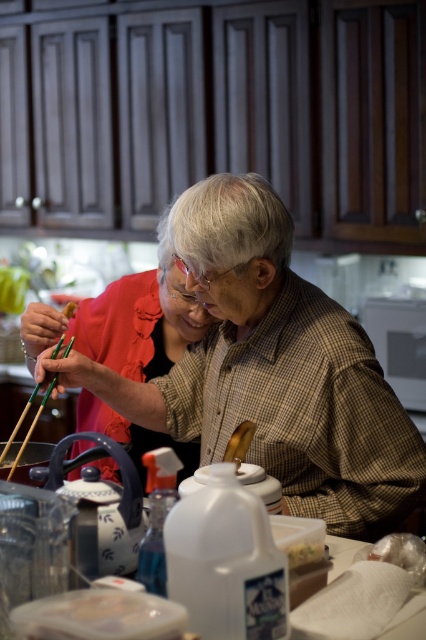
Does point (175, 268) lie behind point (23, 451)?

Yes.

Between point (132, 454) and point (8, 449), which one is positioned behind?

The point (132, 454) is more distant.

Locate an element on the screen. This screenshot has width=426, height=640. matte black shirt at center is located at coordinates (129, 321).

Who is taller, matte brown shirt at center or brown crumbly bread at upper left?

matte brown shirt at center

Can you confirm if matte brown shirt at center is positioned to the right of brown crumbly bread at upper left?

Correct, you'll find matte brown shirt at center to the right of brown crumbly bread at upper left.

Which is in front, point (302, 291) or point (71, 310)?

Point (302, 291) is in front.

You are a GUI agent. You are given a task and a screenshot of the screen. Output one action in this format:
    pyautogui.click(x=<x>, y=<y>)
    Task: Click on the matte brown shirt at center
    
    Given the screenshot: What is the action you would take?
    pyautogui.click(x=271, y=369)

Does point (121, 310) come farther from viewer compared to point (304, 554)?

Yes, it is.

Find the location of a particular element. The width and height of the screenshot is (426, 640). matte black shirt at center is located at coordinates (129, 321).